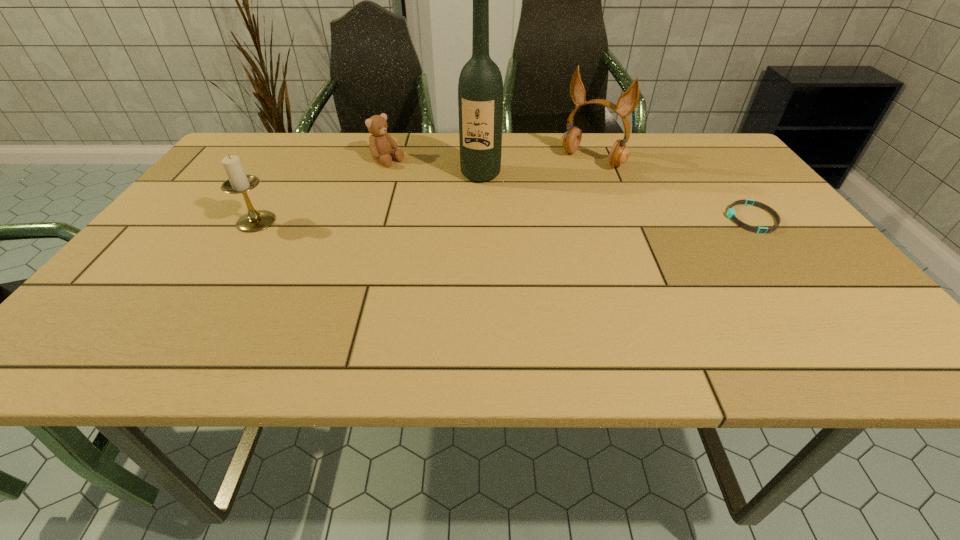
This screenshot has height=540, width=960. Find the location of `vacant space located 0.370m on the labeled side of the wine bottle`. vacant space located 0.370m on the labeled side of the wine bottle is located at coordinates (446, 281).

Identify the location of vacant space located 0.310m on the labeled side of the wine bottle. Image resolution: width=960 pixels, height=540 pixels. (453, 261).

The image size is (960, 540). What are the coordinates of `free space located on the labeled side of the wine bottle` in the screenshot? It's located at (444, 288).

The width and height of the screenshot is (960, 540). In order to click on teddy bear present at the far edge in this screenshot , I will do `click(382, 146)`.

This screenshot has width=960, height=540. I want to click on earphone that is at the far edge, so click(627, 102).

The width and height of the screenshot is (960, 540). I want to click on wine bottle present at the far edge, so click(480, 88).

At what (x,y) coordinates should I click in order to perform the action: click on object present at the left edge. Please return your answer as a coordinate pair (x, y). Looking at the image, I should click on pyautogui.click(x=238, y=182).

Where is `object situated at the right edge`? This screenshot has width=960, height=540. object situated at the right edge is located at coordinates (731, 214).

In the image, there is a desktop. In order to click on free region at the far edge in this screenshot , I will do `click(633, 140)`.

Where is `vacant space at the near edge of the desktop`? vacant space at the near edge of the desktop is located at coordinates (518, 318).